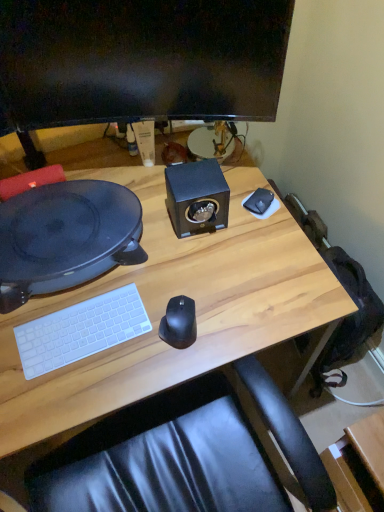
Locate an element on the screen. vacant region to the left of black matte speaker at center is located at coordinates (145, 222).